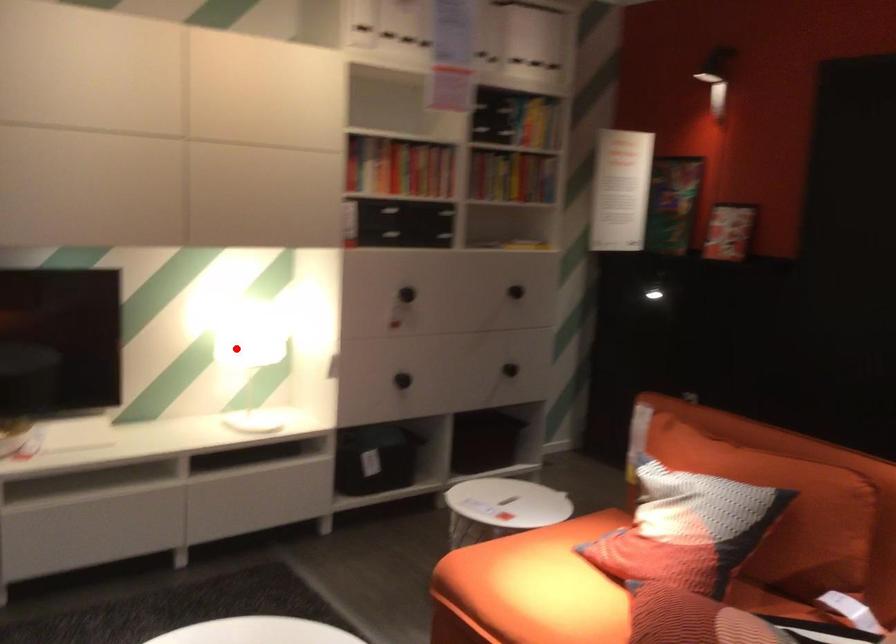
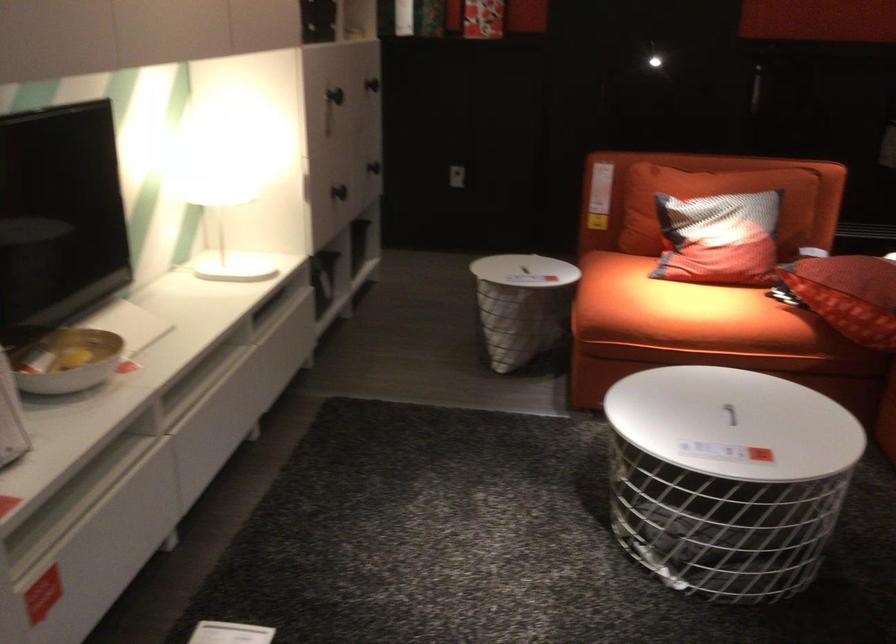
Where in the second image is the point corresponding to the highlighted location from the first image?

(199, 198)